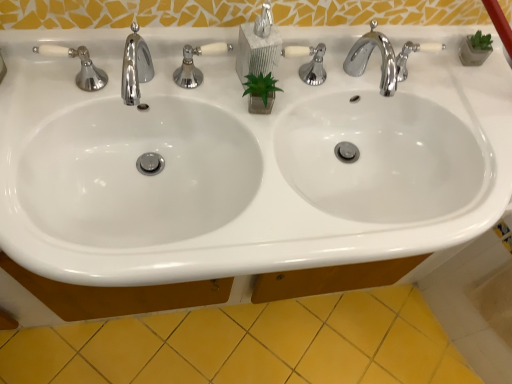
This screenshot has width=512, height=384. I want to click on vacant area that is situated to the right of polished chrome faucet at upper left, the 1th tap positioned from the left, so click(223, 113).